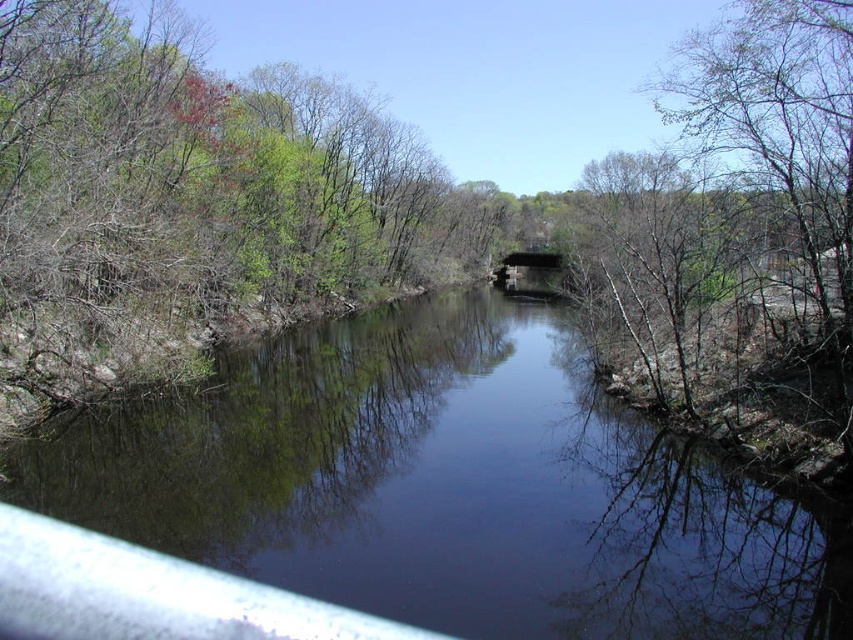
From the picture: You are standing on the bank of the river and want to cross to the other side. You see the transparent water at center and the concrete bridge at center. Which one is closer to your current position?

The transparent water at center is closer to your current position because it is located to the left of the concrete bridge at center, meaning it is nearer to the bank where you are standing.

In the scene shown: You are standing at the point marked by the coordinates point at (450, 486). Looking around, you see the scene described. What is the immediate environment around your current position?

The point at (450, 486) marks transparent water at center, so you are standing in the transparent water at center of the scene.